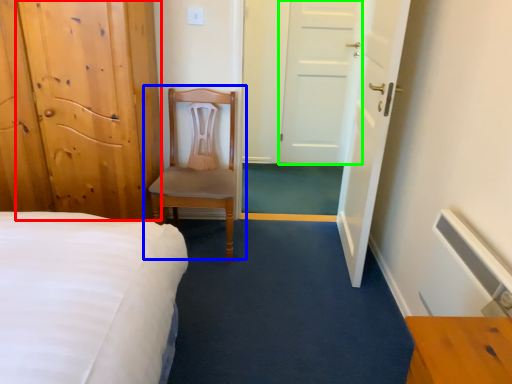
Question: Based on their relative distances, which object is farther from door (highlighted by a red box)? Choose from chair (highlighted by a blue box) and door (highlighted by a green box).

Choices:
 (A) chair
 (B) door

Answer: (B)